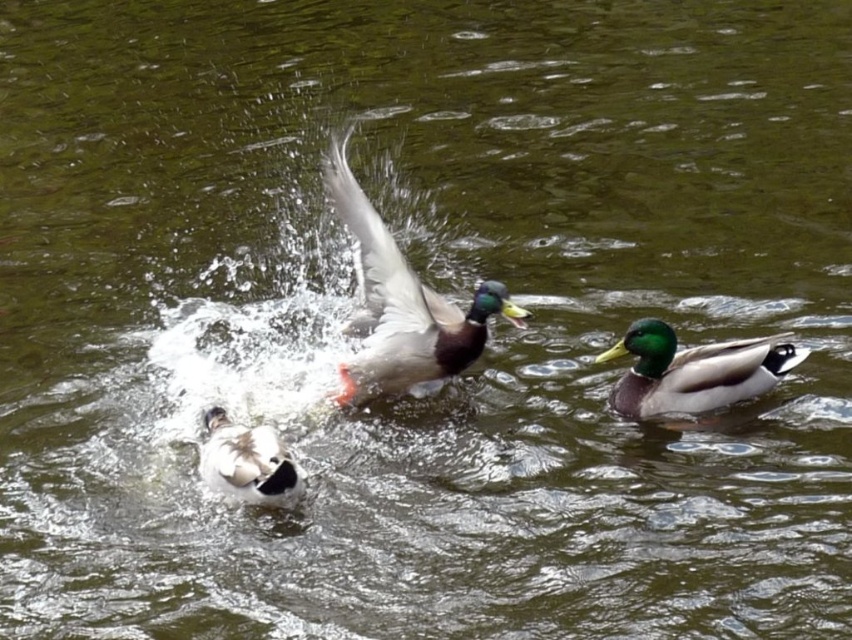
Looking at this image, is shiny green duck at center positioned before white fluffy duck at lower left?

No, shiny green duck at center is further to the viewer.

Between shiny green duck at center and white fluffy duck at lower left, which one is positioned higher?

Positioned higher is shiny green duck at center.

Is point (337, 177) closer to viewer compared to point (296, 477)?

That is False.

Where is `shiny green duck at center`? The image size is (852, 640). shiny green duck at center is located at coordinates (403, 305).

Does green glossy duck at right have a lesser height compared to white fluffy duck at lower left?

No.

Does point (734, 365) come closer to viewer compared to point (279, 477)?

That is False.

Where is `green glossy duck at right`? This screenshot has height=640, width=852. green glossy duck at right is located at coordinates (694, 371).

This screenshot has height=640, width=852. What are the coordinates of `green glossy duck at right` in the screenshot? It's located at (694, 371).

The height and width of the screenshot is (640, 852). What do you see at coordinates (403, 305) in the screenshot? I see `shiny green duck at center` at bounding box center [403, 305].

Can you confirm if shiny green duck at center is positioned to the right of green glossy duck at right?

Incorrect, shiny green duck at center is not on the right side of green glossy duck at right.

Find the location of `shiny green duck at center`. shiny green duck at center is located at coordinates (403, 305).